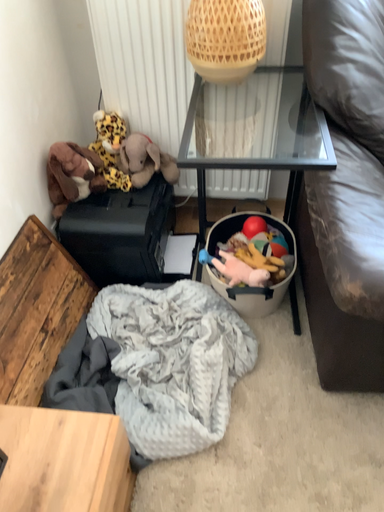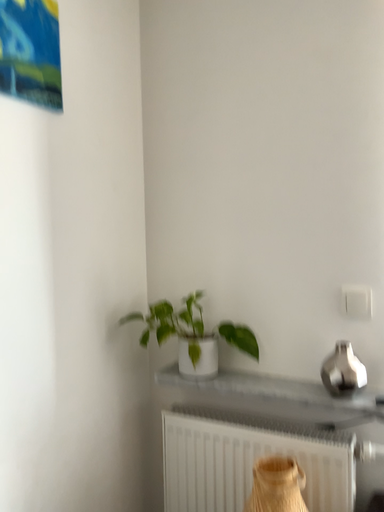
Question: How did the camera likely rotate when shooting the video?

Choices:
 (A) rotated downward
 (B) rotated upward

Answer: (B)